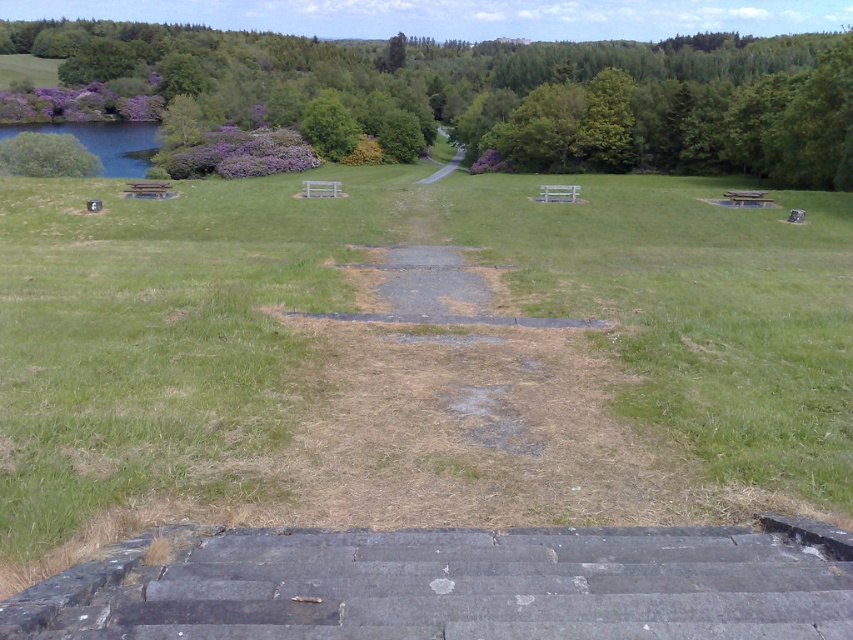
You are planning a picnic and want to set up your blanket near the gravel path at center. However, you also want to ensure you have shade from the green leafy tree at upper left. Based on their positions, will the tree provide shade over the path?

The green leafy tree at upper left is to the left of the gravel path at center, so its shade would extend towards the path. Therefore, the tree can provide shade over the gravel path at center.

You are standing at the base of the dark gray stone stairs at lower center and want to walk towards the green leafy tree at upper left. Which direction should you head to get closer to the tree?

Since the dark gray stone stairs at lower center are closer to you than the green leafy tree at upper left, you should head upwards or towards the upper left direction to move closer to the tree.

You are standing at the bottom of the dark gray stone stairs at lower center and want to reach the green leafy tree at upper left. Which direction should you walk to get closer to the tree?

You should walk upwards towards the green leafy tree at upper left because the dark gray stone stairs at lower center are shorter in height compared to the tree, indicating the tree is higher up.